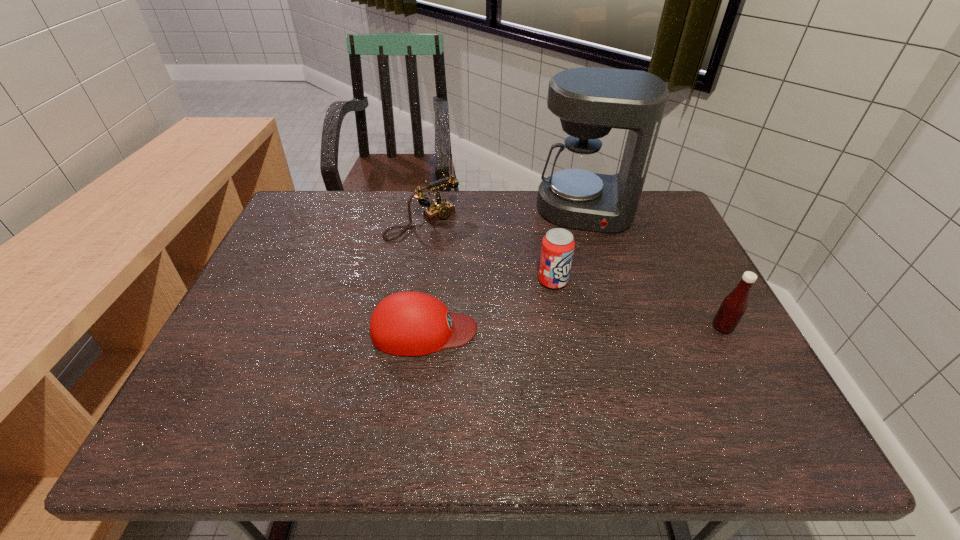
Locate an element on the screen. This screenshot has width=960, height=540. the shortest object is located at coordinates (408, 323).

Where is `the rightmost object`? the rightmost object is located at coordinates (734, 305).

This screenshot has width=960, height=540. What are the coordinates of `telephone` in the screenshot? It's located at (439, 209).

In order to click on the third nearest object in this screenshot , I will do `click(558, 245)`.

Find the location of a particular element. Image resolution: width=960 pixels, height=540 pixels. coffee maker is located at coordinates (590, 101).

Image resolution: width=960 pixels, height=540 pixels. I want to click on free region located on the front-facing side of the baseball cap, so click(x=636, y=330).

This screenshot has height=540, width=960. Identify the location of vacant region located 0.100m on the back of the rightmost object. (703, 290).

The height and width of the screenshot is (540, 960). Find the location of `free space located 0.060m on the front-facing side of the telephone`. free space located 0.060m on the front-facing side of the telephone is located at coordinates (455, 248).

Locate an element on the screen. vacant space located 0.270m on the front-facing side of the telephone is located at coordinates pyautogui.click(x=502, y=291).

Where is `vacant area situated on the front-facing side of the telephone`? vacant area situated on the front-facing side of the telephone is located at coordinates (517, 304).